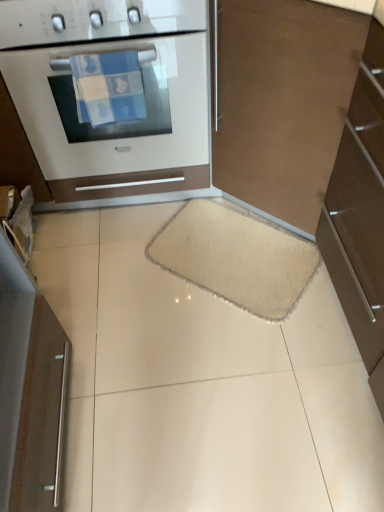
Question: Are brown matte cabinet at right and white glossy oven at upper left far apart?

Choices:
 (A) yes
 (B) no

Answer: (B)

Question: Does brown matte cabinet at right come behind white glossy oven at upper left?

Choices:
 (A) no
 (B) yes

Answer: (A)

Question: Does brown matte cabinet at right have a greater height compared to white glossy oven at upper left?

Choices:
 (A) no
 (B) yes

Answer: (B)

Question: Are brown matte cabinet at right and white glossy oven at upper left making contact?

Choices:
 (A) yes
 (B) no

Answer: (B)

Question: Considering the relative sizes of brown matte cabinet at right and white glossy oven at upper left in the image provided, is brown matte cabinet at right smaller than white glossy oven at upper left?

Choices:
 (A) no
 (B) yes

Answer: (B)

Question: In terms of width, does metallic silver fridge at left look wider or thinner when compared to brown matte cabinet at right?

Choices:
 (A) wide
 (B) thin

Answer: (B)

Question: Would you say metallic silver fridge at left is to the left or to the right of brown matte cabinet at right in the picture?

Choices:
 (A) right
 (B) left

Answer: (B)

Question: In terms of size, does metallic silver fridge at left appear bigger or smaller than brown matte cabinet at right?

Choices:
 (A) big
 (B) small

Answer: (B)

Question: From the image's perspective, is metallic silver fridge at left positioned above or below brown matte cabinet at right?

Choices:
 (A) below
 (B) above

Answer: (A)

Question: Considering the positions of metallic silver fridge at left and beige fuzzy mat at center in the image, is metallic silver fridge at left taller or shorter than beige fuzzy mat at center?

Choices:
 (A) short
 (B) tall

Answer: (B)

Question: Is metallic silver fridge at left wider or thinner than beige fuzzy mat at center?

Choices:
 (A) wide
 (B) thin

Answer: (B)

Question: Considering their positions, is metallic silver fridge at left located in front of or behind beige fuzzy mat at center?

Choices:
 (A) behind
 (B) front

Answer: (B)

Question: From a real-world perspective, relative to beige fuzzy mat at center, is metallic silver fridge at left vertically above or below?

Choices:
 (A) above
 (B) below

Answer: (A)

Question: In terms of width, does beige fuzzy mat at center look wider or thinner when compared to metallic silver fridge at left?

Choices:
 (A) wide
 (B) thin

Answer: (A)

Question: From the image's perspective, relative to metallic silver fridge at left, is beige fuzzy mat at center above or below?

Choices:
 (A) below
 (B) above

Answer: (B)